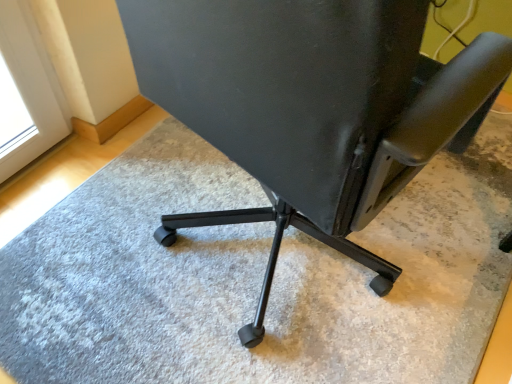
Identify the location of black matte office chair at center. (311, 106).

Image resolution: width=512 pixels, height=384 pixels. Describe the element at coordinates (311, 106) in the screenshot. I see `black matte office chair at center` at that location.

What is the approximate width of black matte office chair at center?

black matte office chair at center is 26.36 inches in width.

Locate an element on the screen. The width and height of the screenshot is (512, 384). black matte office chair at center is located at coordinates (311, 106).